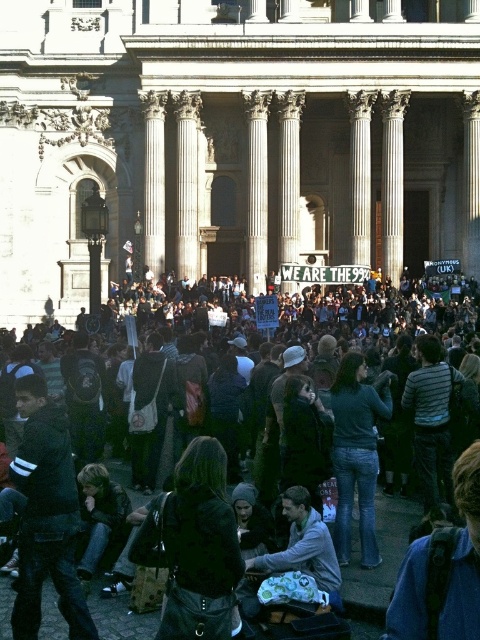
You are planning to deliver a speech to the dark gray fabric crowd at center and the gray fabric jacket at center. What is the minimum distance you need to cover to reach both groups from your starting point at the building entrance?

The minimum distance you need to cover is 19.44 meters, which is the distance between the dark gray fabric crowd at center and the gray fabric jacket at center.